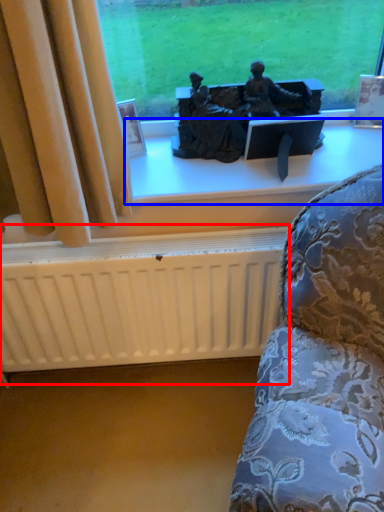
Question: Which point is closer to the camera, radiator (highlighted by a red box) or window sill (highlighted by a blue box)?

Choices:
 (A) radiator
 (B) window sill

Answer: (A)